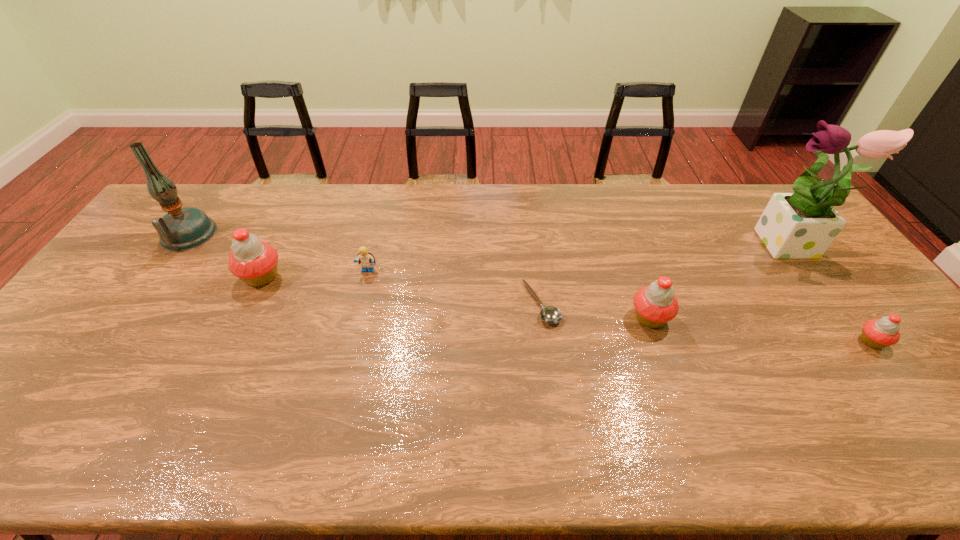
Where is `the shortest object`? This screenshot has width=960, height=540. the shortest object is located at coordinates click(549, 314).

This screenshot has height=540, width=960. Identify the location of free space located 0.070m on the back of the second object from left to right. [x=276, y=246].

Find the location of a particular element. This screenshot has height=540, width=960. free space located 0.080m on the right of the fifth object from left to right is located at coordinates pyautogui.click(x=701, y=318).

Where is `vacant region located 0.340m on the back of the shortest cupcake`? The width and height of the screenshot is (960, 540). vacant region located 0.340m on the back of the shortest cupcake is located at coordinates (799, 244).

Find the location of a particular element. The image size is (960, 540). vacant space located 0.230m on the front of the leftmost object is located at coordinates (134, 310).

Where is `vacant space located 0.050m on the front-facing side of the flower arrangement`? vacant space located 0.050m on the front-facing side of the flower arrangement is located at coordinates (739, 247).

At what (x,y) coordinates should I click in order to perform the action: click on free region located on the front-facing side of the flower arrangement. Please return your answer as a coordinate pair (x, y). Looking at the image, I should click on (647, 247).

Identify the location of free point located on the front-facing side of the flower arrangement. (x=638, y=247).

The image size is (960, 540). Find the location of `free space located 0.330m on the front-facing side of the fifth object from right to left`. free space located 0.330m on the front-facing side of the fifth object from right to left is located at coordinates (343, 374).

You are a GUI agent. You are given a task and a screenshot of the screen. Output one action in this format:
    pyautogui.click(x=<x>, y=<y>)
    Task: Click on the vacant space located 0.340m on the back of the shortest object
    This screenshot has height=540, width=960.
    Given the screenshot: What is the action you would take?
    point(530,211)